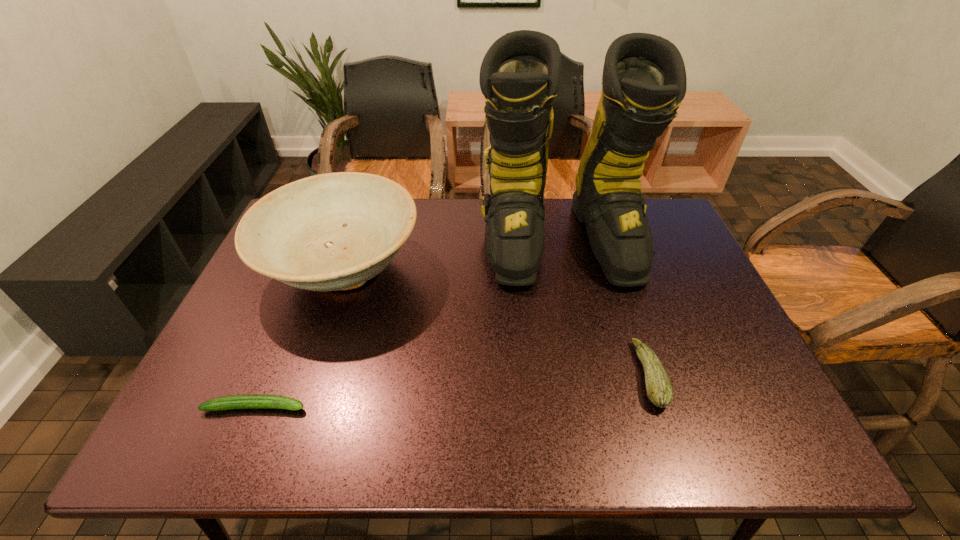
Find the location of a particular element. The height and width of the screenshot is (540, 960). object present at the far right corner is located at coordinates (644, 80).

In the image, there is a desktop. Identify the location of vacant space at the far edge. The height and width of the screenshot is (540, 960). (572, 217).

Find the location of a particular element. The image size is (960, 540). vacant area at the near edge of the desktop is located at coordinates (434, 432).

Identify the location of vacant region at the left edge. (289, 338).

In the image, there is a desktop. What are the coordinates of `blank space at the right edge` in the screenshot? It's located at (709, 316).

You are a GUI agent. You are given a task and a screenshot of the screen. Output one action in this format:
    pyautogui.click(x=<x>, y=<y>)
    Task: Click on the vacant region at the near right corner of the desktop
    Image resolution: width=960 pixels, height=540 pixels.
    Given the screenshot: What is the action you would take?
    pyautogui.click(x=776, y=422)

Where is `free space between the second tallest object and the tallest object`? The width and height of the screenshot is (960, 540). free space between the second tallest object and the tallest object is located at coordinates (451, 255).

Identify the location of empty space between the third shortest object and the ski boots. (451, 255).

You are a GUI agent. You are given a task and a screenshot of the screen. Output one action in this format:
    pyautogui.click(x=<x>, y=<y>)
    Task: Click on the vacant area between the shortest object and the taller zucchini
    The width and height of the screenshot is (960, 540).
    Given the screenshot: What is the action you would take?
    pyautogui.click(x=452, y=391)

Identify the location of free space between the left zucchini and the second tallest object. (299, 339).